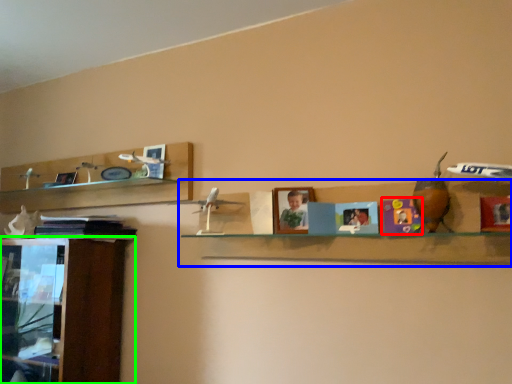
Question: Which object is positioned closest to toy (highlighted by a red box)? Select from shelf (highlighted by a blue box) and cabinetry (highlighted by a green box).

Choices:
 (A) shelf
 (B) cabinetry

Answer: (A)